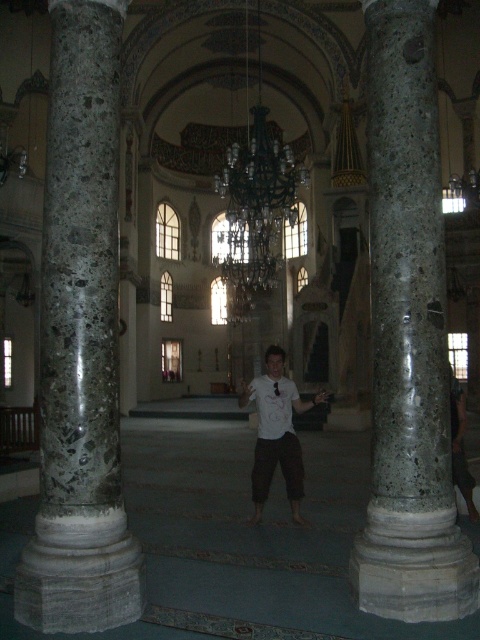
You are standing at the entrance of the mosque and want to locate the marble column at left. According to the coordinate system where the bottom left corner is the origin, can you determine its position?

The marble column at left is located at coordinates approximately 0.536 on the x axis and 0.169 on the y axis.

You are standing in the grand historic mosque and want to place your dark brown leather pants at right near the marble column at left. Can you move them closer without moving the column?

The marble column at left is to the left of dark brown leather pants at right, so you can move the dark brown leather pants at right closer to the marble column at left since they are already positioned to the right of it.